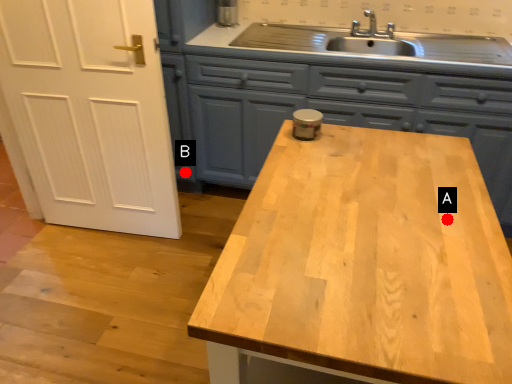
Question: Two points are circled on the image, labeled by A and B beside each circle. Which of the following is the farthest from the observer?

Choices:
 (A) A is further
 (B) B is further

Answer: (B)